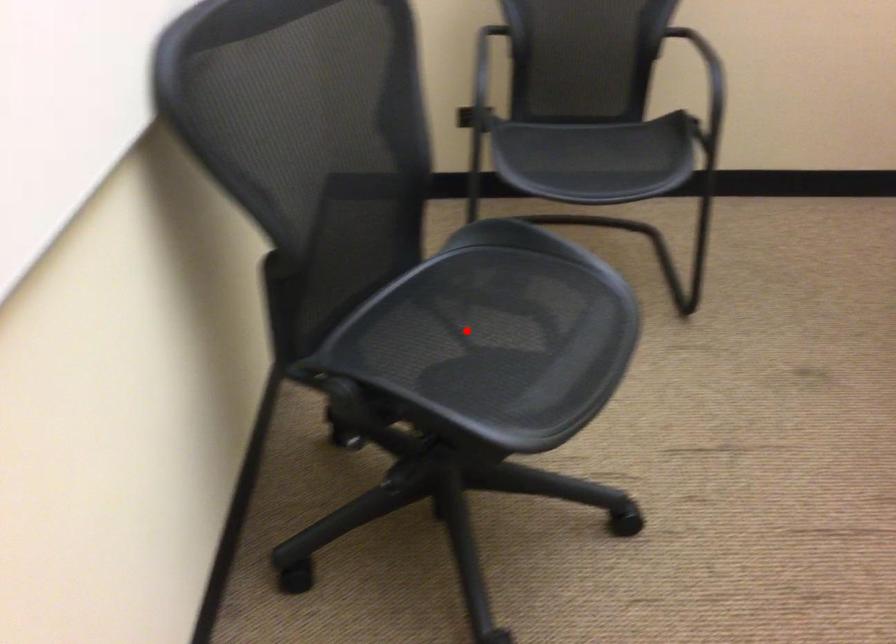
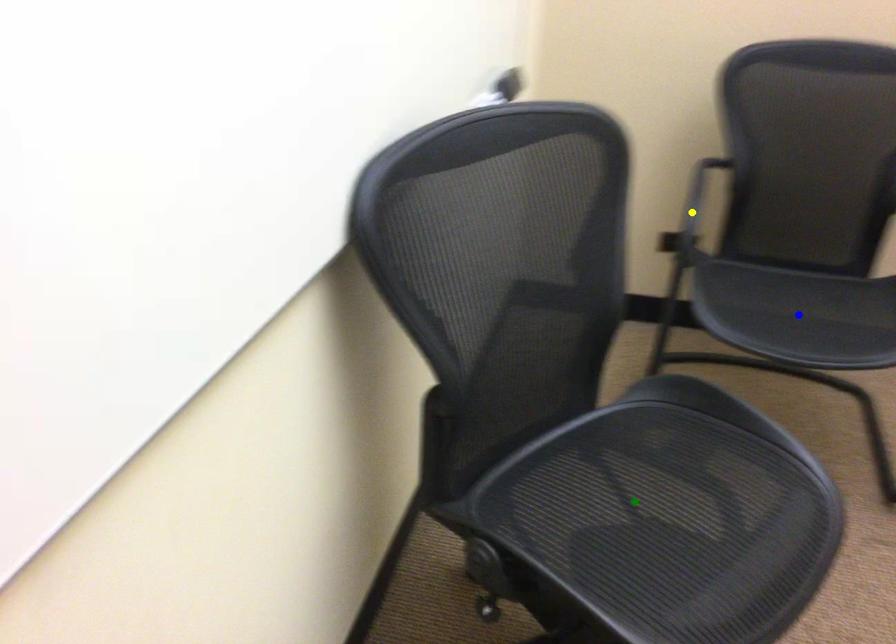
Question: I am providing you with two images of the same scene from different viewpoints. A red point is marked on the first image. You are given multiple points on the second image. Which point in image 2 is actually the same real-world point as the red point in image 1?

Choices:
 (A) green point
 (B) blue point
 (C) yellow point

Answer: (A)